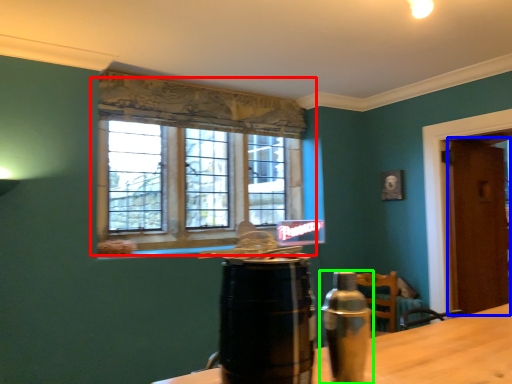
Question: Estimate the real-world distances between objects in this image. Which object is closer to window (highlighted by a red box), door (highlighted by a blue box) or bottle (highlighted by a green box)?

Choices:
 (A) door
 (B) bottle

Answer: (A)